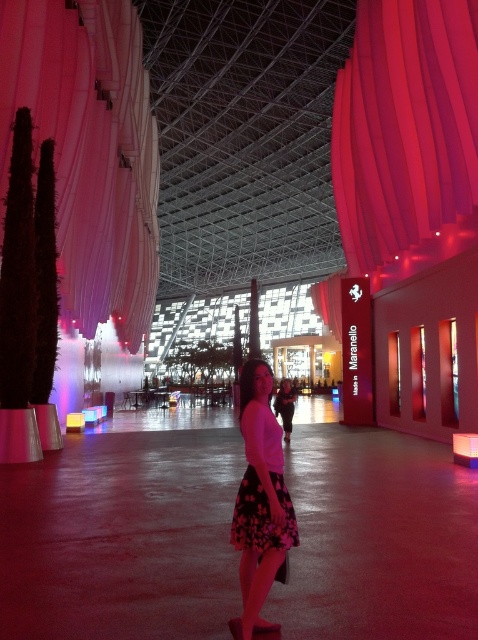
You are a fashion photographer setting up a shoot in the described indoor area. You need to decide which garment between the white matte skirt at center and the floral cotton dress at center would be more visible against the red backdrop. Based on their descriptions, which one would you choose and why?

The white matte skirt at center is thinner than the floral cotton dress at center. Since the white matte skirt is thinner, it might create a clearer silhouette against the red backdrop, making it more visible.

You are standing in the indoor area and want to locate the matte pink curtain at upper right. According to the coordinates provided, where exactly is it positioned?

The matte pink curtain at upper right is precisely located at the coordinate point 0.198 along the horizontal axis and 0.847 along the vertical axis.

In the scene shown: You are a photographer adjusting the lighting in this scene. You need to determine which object, the matte pink curtain at upper right or the matte black dress at center, is closer to the camera to adjust the focus properly. Which one should you focus on first?

The matte pink curtain at upper right is closer to the viewer than the matte black dress at center, so you should focus on the matte pink curtain at upper right first.